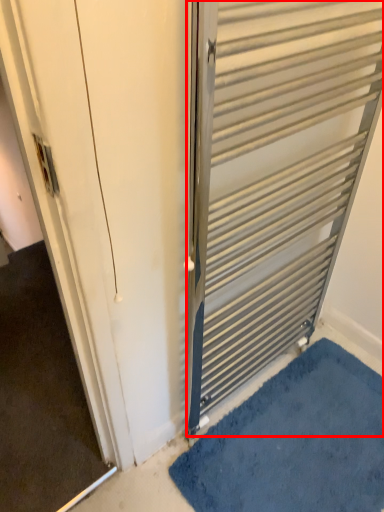
Question: From the image, what is the correct spatial relationship of door (annotated by the red box) in relation to bath mat?

Choices:
 (A) left
 (B) right

Answer: (A)